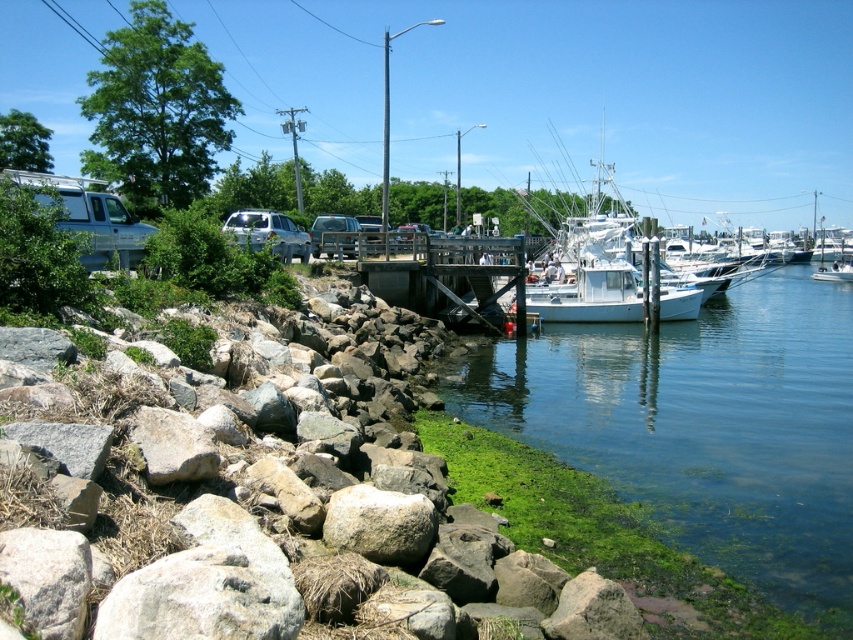
Question: Which object is farther from the camera taking this photo?

Choices:
 (A) white matte van at left
 (B) gray rough rock at lower left
 (C) green algae-covered water at lower right
 (D) gray rough rock at lower center

Answer: (A)

Question: In this image, where is rocky shore at lower left located relative to gray rough rock at lower left?

Choices:
 (A) left
 (B) right

Answer: (B)

Question: Is wooden dock at center wider than gray rough rock at lower center?

Choices:
 (A) yes
 (B) no

Answer: (A)

Question: Which of the following is the closest to the observer?

Choices:
 (A) gray rough rock at lower center
 (B) wooden dock at center

Answer: (A)

Question: Which point appears closest to the camera in this image?

Choices:
 (A) (163, 424)
 (B) (64, 209)

Answer: (A)

Question: Does gray rough rock at lower center appear under gray rough rock at lower left?

Choices:
 (A) yes
 (B) no

Answer: (A)